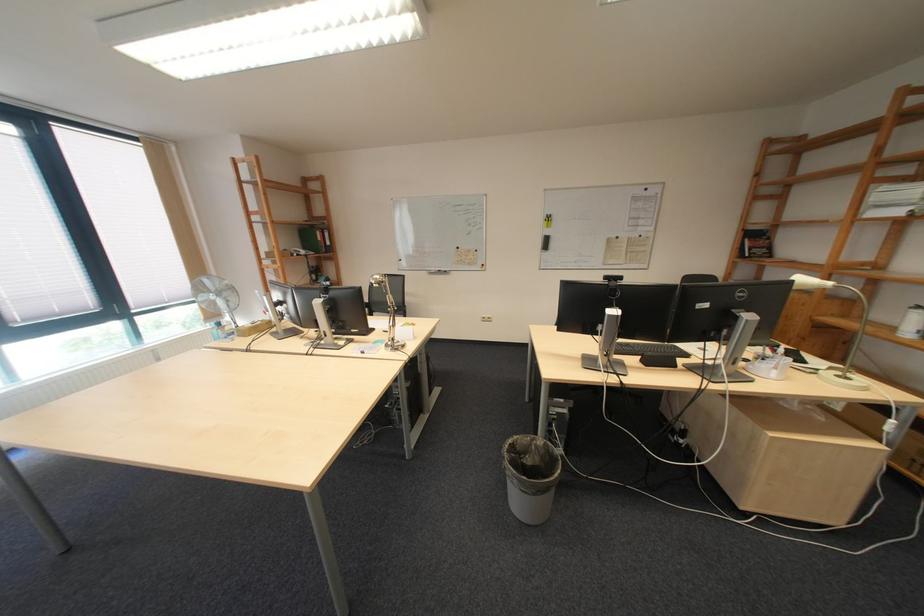
What do you see at coordinates (313, 289) in the screenshot? I see `the fan control buttons` at bounding box center [313, 289].